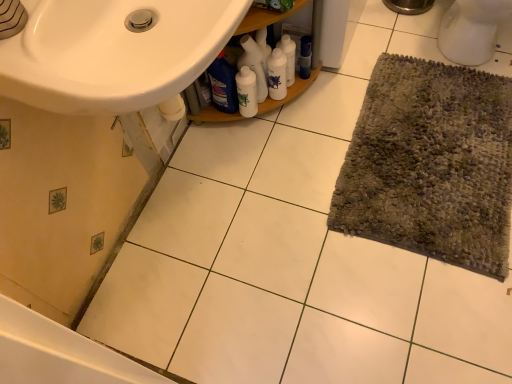
Question: Do you think white glossy bottle at center is within multicolored textured rug at right, or outside of it?

Choices:
 (A) outside
 (B) inside

Answer: (A)

Question: Looking at the image, does white glossy bottle at center seem bigger or smaller compared to multicolored textured rug at right?

Choices:
 (A) small
 (B) big

Answer: (A)

Question: Which object is positioned closest to the white glossy bottle at center, the 4th cleaning product viewed from the left?

Choices:
 (A) white glossy bottles at center, arranged as the 3th cleaning product when viewed from the left
 (B) white glossy sink at upper left
 (C) white glossy bottle at center, which ranks as the 3th cleaning product in right-to-left order
 (D) multicolored textured rug at right
 (E) blue glossy bottle at center, positioned as the 4th cleaning product in right-to-left order

Answer: (A)

Question: Which of these objects is positioned closest to the white glossy bottle at center, which ranks as the 2th cleaning product in left-to-right order?

Choices:
 (A) white glossy bottle at center
 (B) blue glossy bottle at center, the 1th cleaning product positioned from the left
 (C) white glossy bottles at center
 (D) white glossy bottle at center, the 4th cleaning product viewed from the left
 (E) multicolored textured rug at right

Answer: (A)